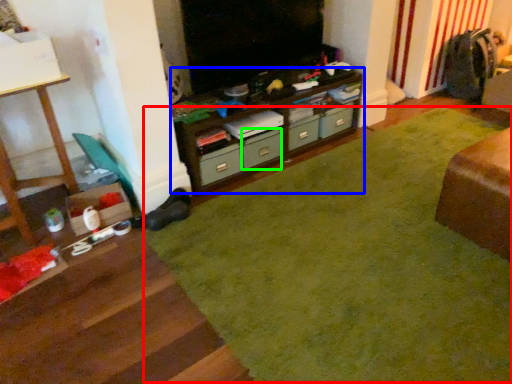
Question: Considering the real-world distances, which object is closest to plain (highlighted by a red box)? cabinetry (highlighted by a blue box) or drawer (highlighted by a green box).

Choices:
 (A) cabinetry
 (B) drawer

Answer: (A)